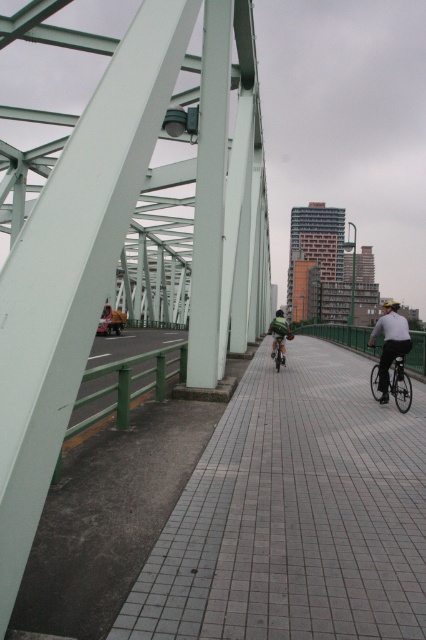
Is shiny silver bicycle at center-right behind green matte bicycle at center?

No.

Is point (374, 390) positioned after point (282, 358)?

No, it is in front of (282, 358).

Is point (374, 376) closer to viewer compared to point (275, 353)?

Yes, it is in front of point (275, 353).

Locate an element on the screen. shiny silver bicycle at center-right is located at coordinates (393, 385).

Is smooth concrete sidewalk at center below shiny silver bicycle at center-right?

Indeed, smooth concrete sidewalk at center is positioned under shiny silver bicycle at center-right.

Is the position of smooth concrete sidewalk at center less distant than that of shiny silver bicycle at center-right?

Yes, smooth concrete sidewalk at center is closer to the viewer.

Between point (359, 552) and point (400, 376), which one is positioned behind?

The point (400, 376) is behind.

You are a GUI agent. You are given a task and a screenshot of the screen. Output one action in this format:
    pyautogui.click(x=<x>, y=<y>)
    Task: Click on the smooth concrete sidewalk at center
    
    Given the screenshot: What is the action you would take?
    pyautogui.click(x=294, y=515)

Is smooth concrete sidewalk at center bigger than green matte bicycle at center?

Correct, smooth concrete sidewalk at center is larger in size than green matte bicycle at center.

Where is `smooth concrete sidewalk at center`? Image resolution: width=426 pixels, height=640 pixels. smooth concrete sidewalk at center is located at coordinates (294, 515).